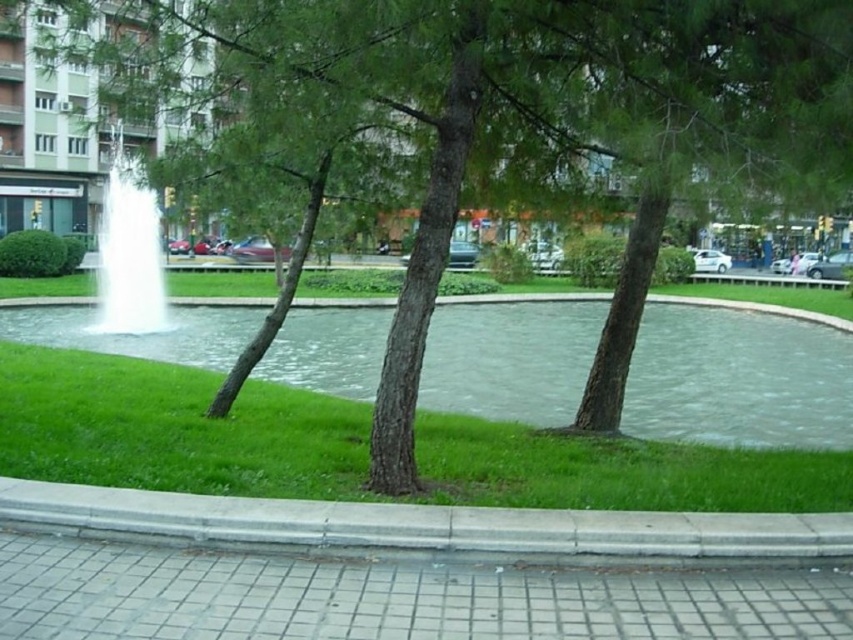
Is green grass at center below gray concrete sidewalk at lower left?

No.

Between green grass at center and gray concrete sidewalk at lower left, which one is positioned lower?

gray concrete sidewalk at lower left is lower down.

Does point (612, 500) come farther from viewer compared to point (210, 563)?

Yes, point (612, 500) is behind point (210, 563).

Where is `green grass at center`? The image size is (853, 640). green grass at center is located at coordinates [x=173, y=428].

Which of these two, green grass at center or white frothy water at center, stands taller?

white frothy water at center is taller.

Is point (161, 440) closer to camera compared to point (111, 160)?

Yes, it is.

Identify the location of green grass at center. Image resolution: width=853 pixels, height=640 pixels. (173, 428).

This screenshot has height=640, width=853. In order to click on green grass at center in this screenshot , I will do `click(173, 428)`.

Is gray concrete curb at lower center taller than white frothy water at center?

No, gray concrete curb at lower center is not taller than white frothy water at center.

The image size is (853, 640). In order to click on gray concrete curb at lower center in this screenshot , I will do `click(421, 524)`.

I want to click on gray concrete curb at lower center, so click(x=421, y=524).